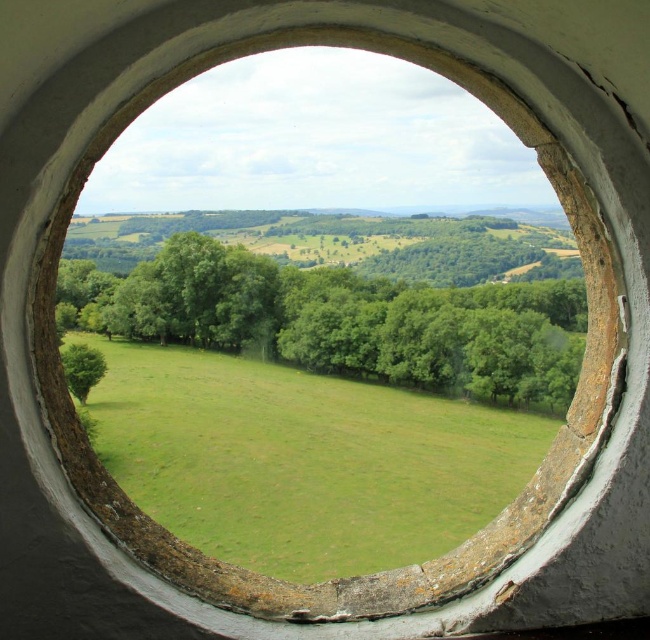
You are standing in a room with a circular window. You see two points marked in the scene through the window. The first point is at coordinate point (188, 460) and the second is at point (343, 372). Which point is closer to you?

Point (188, 460) is closer to the viewer than point (343, 372).